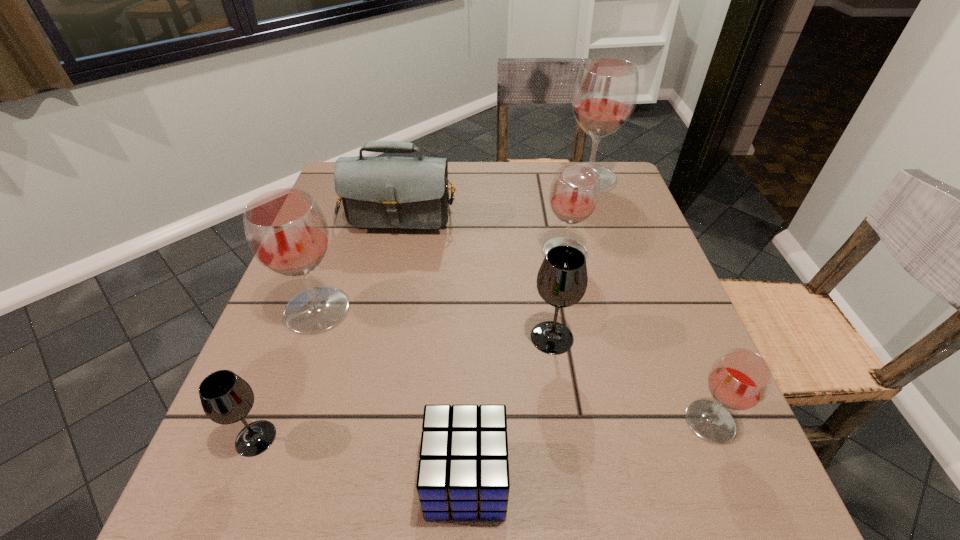
Locate an element on the screen. The height and width of the screenshot is (540, 960). free region that satisfies the following two spatial constraints: 1. on the front side of the shortest object; 2. on the right side of the left gray wineglass is located at coordinates (240, 480).

Locate an element on the screen. The height and width of the screenshot is (540, 960). free space in the image that satisfies the following two spatial constraints: 1. on the front side of the nearest red wineglass; 2. on the left side of the second tallest object is located at coordinates (277, 422).

Where is `vacant space that satisfies the following two spatial constraints: 1. on the front side of the red cube; 2. on the right side of the nearer gray wineglass`? This screenshot has width=960, height=540. vacant space that satisfies the following two spatial constraints: 1. on the front side of the red cube; 2. on the right side of the nearer gray wineglass is located at coordinates (240, 480).

This screenshot has width=960, height=540. Identify the location of free point that satisfies the following two spatial constraints: 1. on the front side of the bigger gray wineglass; 2. on the left side of the second tallest object. (307, 338).